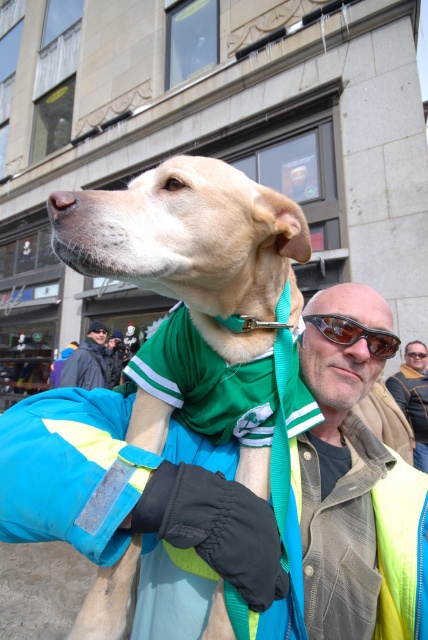
You are a photographer trying to capture the perfect shot of the shiny black sunglasses at center and the sunglasses at upper center. Which of the two sunglasses is positioned to the right side of the other?

The shiny black sunglasses at center is positioned to the right of the sunglasses at upper center.

You are a photographer trying to capture the man and his dog in the image. You notice the leather jacket at center and the sunglasses at upper center. Which object should you focus on first if you want to frame the lower part of the scene?

The leather jacket at center is located below the sunglasses at upper center, so to frame the lower part of the scene, focus on the leather jacket at center first.

You are a photographer trying to capture a portrait of the dark gray jacket at center and the green fabric at center. Since you want both subjects to be clearly visible, which one should you focus on first to ensure depth of field covers both?

The dark gray jacket at center is taller than the green fabric at center, so focusing on the taller object first will ensure the depth of field captures both subjects.